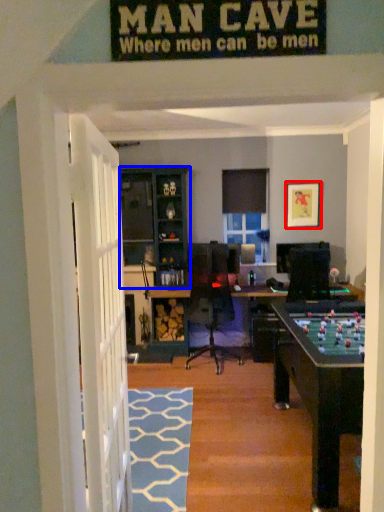
Question: Which object appears closest to the camera in this image, picture frame (highlighted by a red box) or cabinetry (highlighted by a blue box)?

Choices:
 (A) picture frame
 (B) cabinetry

Answer: (B)